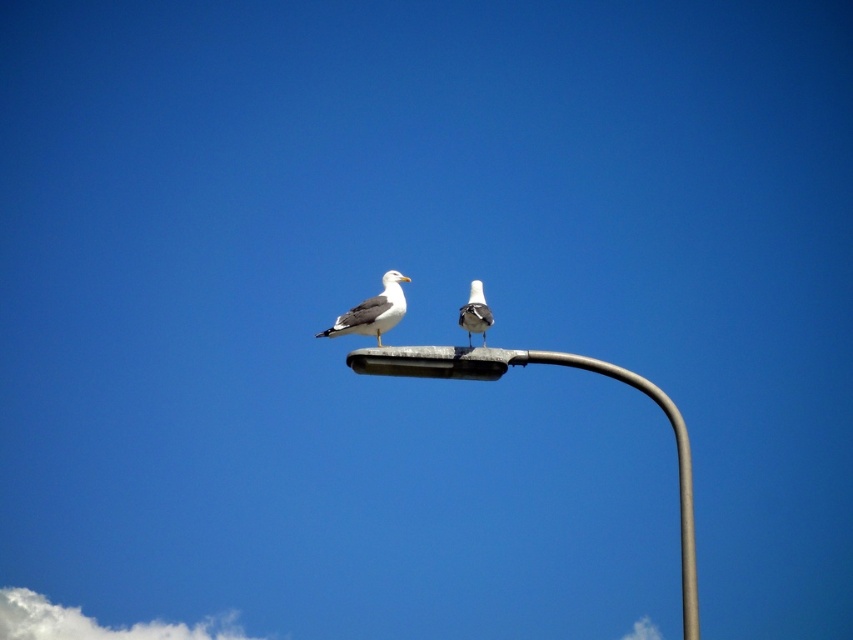
Between point (338, 316) and point (477, 301), which one is positioned in front?

Point (477, 301) is in front.

Which is more to the right, white matte seagull at center or white matte bird at center?

Positioned to the right is white matte bird at center.

At what (x,y) coordinates should I click in order to perform the action: click on white matte seagull at center. Please return your answer as a coordinate pair (x, y). Looking at the image, I should click on (373, 310).

Does satin silver street light at upper center have a larger size compared to white matte bird at center?

Yes.

Between point (683, 616) and point (474, 321), which one is positioned in front?

Point (474, 321)

Between point (370, 371) and point (480, 291), which one is positioned behind?

Positioned behind is point (480, 291).

I want to click on satin silver street light at upper center, so click(x=555, y=364).

Is satin silver street light at upper center to the right of white matte seagull at center from the viewer's perspective?

Yes, satin silver street light at upper center is to the right of white matte seagull at center.

Can you confirm if satin silver street light at upper center is taller than white matte seagull at center?

Yes, satin silver street light at upper center is taller than white matte seagull at center.

Measure the distance between point (496, 364) and camera.

Point (496, 364) is 266.76 feet from camera.

Find the location of a particular element. The image size is (853, 640). satin silver street light at upper center is located at coordinates (555, 364).